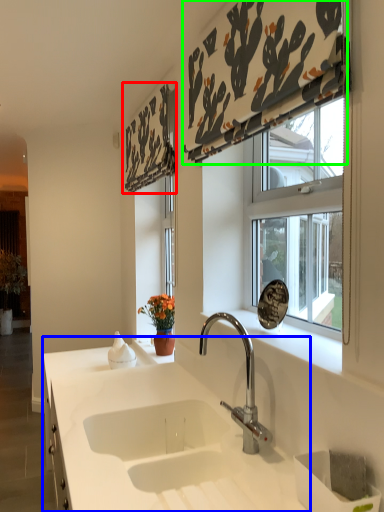
Question: Which object is positioned farthest from curtain (highlighted by a red box)? Select from countertop (highlighted by a blue box) and curtain (highlighted by a green box).

Choices:
 (A) countertop
 (B) curtain

Answer: (A)